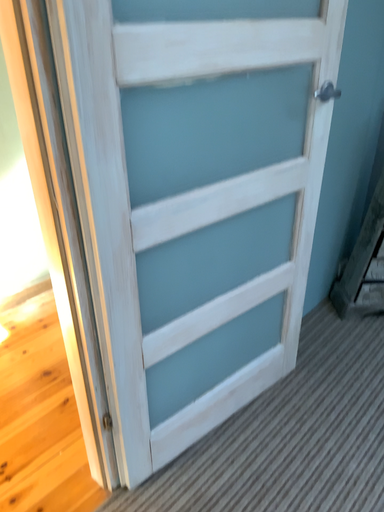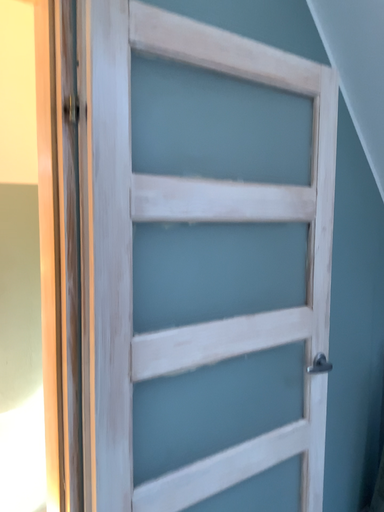
Question: Which way did the camera rotate in the video?

Choices:
 (A) rotated downward
 (B) rotated upward

Answer: (B)